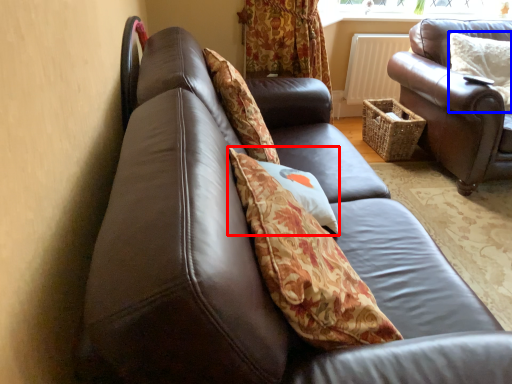
Question: Among these objects, which one is farthest to the camera, pillow (highlighted by a red box) or pillow (highlighted by a blue box)?

Choices:
 (A) pillow
 (B) pillow

Answer: (B)